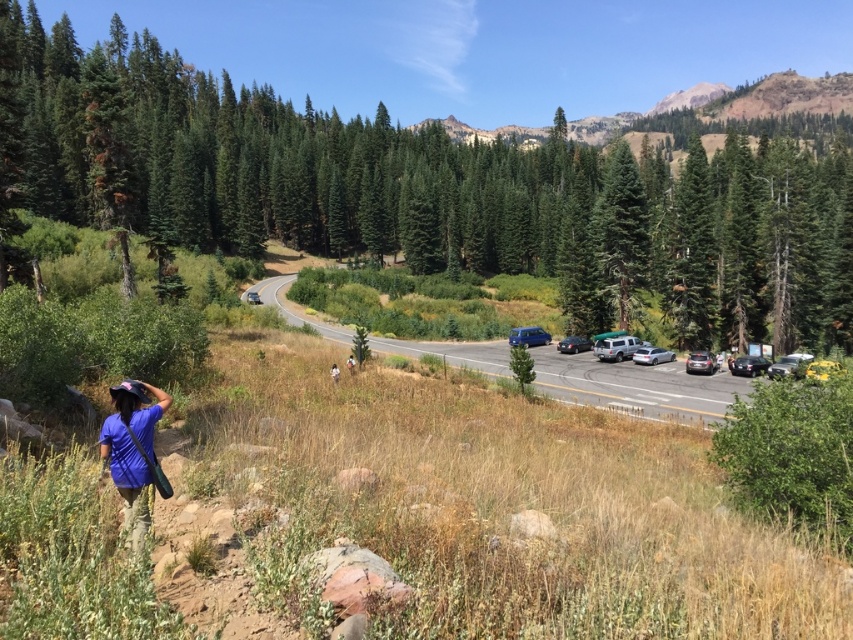
You are a hiker who needs to decide whether to place your blue fabric bag at lower left next to the green leafy tree at center. Considering their sizes, which one is wider?

The green leafy tree at center is wider than the blue fabric bag at lower left, so it is wider.

You are a delivery driver who needs to park your satin silver suv at right near the metallic asphalt highway at center. Based on the scene, can you safely park your vehicle within 100 feet of the highway?

The metallic asphalt highway at center and satin silver suv at right are 84.98 feet apart, which is within the 100 feet limit. Therefore, you can safely park your satin silver suv at right near the metallic asphalt highway at center within the required distance.